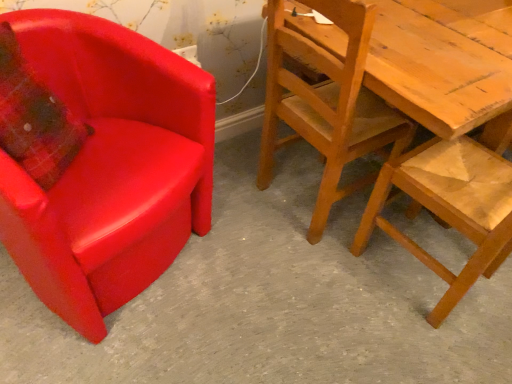
Locate an element on the screen. The image size is (512, 384). vacant area situated to the left side of wooden chair at right, the second chair positioned from the left is located at coordinates (237, 190).